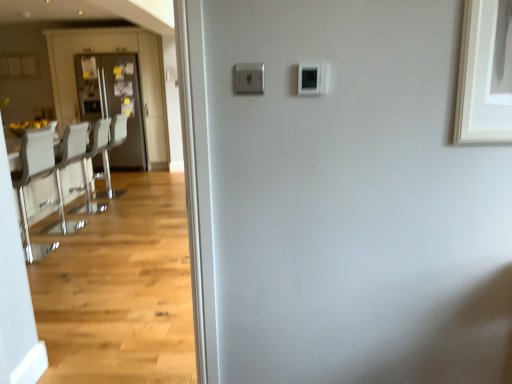
The height and width of the screenshot is (384, 512). Identify the location of matte gray door at left. (114, 102).

The width and height of the screenshot is (512, 384). What do you see at coordinates (112, 52) in the screenshot? I see `matte black refrigerator at left` at bounding box center [112, 52].

What do you see at coordinates (31, 181) in the screenshot?
I see `white glossy chair at left` at bounding box center [31, 181].

In order to face white glossy armchair at left, positioned as the second armchair in back-to-front order, should I rotate leftwards or rightwards?

You should rotate left by 21.530 degrees.

Where is `matte gray door at left`? The width and height of the screenshot is (512, 384). matte gray door at left is located at coordinates (114, 102).

Locate an element on the screen. furniture above the white glossy chair at left (from the image's perspective) is located at coordinates (37, 179).

In the scene shown: Does white glossy chair at left have a greater width compared to white leather chairs at left?

No.

What's the angular difference between white glossy chair at left and white leather chairs at left's facing directions?

There is a 0.000952-degree angle between the facing directions of white glossy chair at left and white leather chairs at left.

Is matte black refrigerator at left bigger than white glossy chair at left?

Correct, matte black refrigerator at left is larger in size than white glossy chair at left.

Which object is closer to the camera, matte black refrigerator at left or white glossy chair at left?

white glossy chair at left.

Is matte black refrigerator at left facing away from white glossy chair at left?

No, matte black refrigerator at left's orientation is not away from white glossy chair at left.

Is matte black refrigerator at left situated inside white glossy chair at left or outside?

matte black refrigerator at left is outside white glossy chair at left.

Between matte black refrigerator at left and white leather chairs at left, which one has larger size?

With larger size is matte black refrigerator at left.

Would you say matte black refrigerator at left contains white leather chairs at left?

Definitely not — white leather chairs at left is not inside matte black refrigerator at left.

Which of these two, matte black refrigerator at left or white leather chairs at left, stands taller?

With more height is matte black refrigerator at left.

Is point (58, 55) behind point (21, 155)?

Yes, it is.

Can you tell me how much white glossy chair at left and matte gray door at left differ in facing direction?

The facing directions of white glossy chair at left and matte gray door at left are 94.1 degrees apart.

From the image's perspective, which is above, white glossy chair at left or matte gray door at left?

matte gray door at left, from the image's perspective.

Considering the positions of points (25, 154) and (83, 100), is point (25, 154) closer to camera compared to point (83, 100)?

Yes, point (25, 154) is closer to viewer.

From a real-world perspective, does white glossy chair at left sit lower than matte gray door at left?

Yes, from a real-world perspective, white glossy chair at left is under matte gray door at left.

Could you tell me if white leather chairs at left is turned towards matte black refrigerator at left?

No, white leather chairs at left is not turned towards matte black refrigerator at left.

Does white leather chairs at left have a greater width compared to matte black refrigerator at left?

Incorrect, the width of white leather chairs at left does not surpass that of matte black refrigerator at left.

Choose the correct answer: Is white leather chairs at left inside matte black refrigerator at left or outside it?

white leather chairs at left cannot be found inside matte black refrigerator at left.

Is point (41, 122) farther from camera compared to point (121, 40)?

No.

Which object is further away from the camera, white leather armchair at left, acting as the first armchair starting from the back, or white glossy chair at left?

white leather armchair at left, acting as the first armchair starting from the back.

Are white leather armchair at left, acting as the first armchair starting from the back, and white glossy chair at left beside each other?

white leather armchair at left, acting as the first armchair starting from the back, and white glossy chair at left are clearly separated.

Considering the sizes of objects white leather armchair at left, acting as the first armchair starting from the back, and white glossy chair at left in the image provided, who is taller, white leather armchair at left, acting as the first armchair starting from the back, or white glossy chair at left?

white leather armchair at left, acting as the first armchair starting from the back.

Looking at this image, is white leather armchair at left, acting as the first armchair starting from the back, bigger than white glossy chair at left?

No.

Is matte gray door at left bigger than white glossy chair at left?

Correct, matte gray door at left is larger in size than white glossy chair at left.

Is matte gray door at left placed right next to white glossy chair at left?

matte gray door at left and white glossy chair at left are not in contact.

Can you tell me how much matte gray door at left and white glossy chair at left differ in facing direction?

matte gray door at left and white glossy chair at left are facing 94.1 degrees away from each other.

From a real-world perspective, is matte gray door at left beneath white glossy chair at left?

No.

Locate an element on the screen. The height and width of the screenshot is (384, 512). chair lying in front of the white leather chairs at left is located at coordinates (31, 181).

The height and width of the screenshot is (384, 512). I want to click on screen door located on the left of white glossy chair at left, so click(x=112, y=52).

From the image, which object appears to be farther from white glossy chair at left, matte black refrigerator at left or matte gray door at left?

matte black refrigerator at left is positioned further to the anchor white glossy chair at left.

Estimate the real-world distances between objects in this image. Which object is further from white leather armchair at left, acting as the first armchair starting from the back, white glossy chair at left or matte gray door at left?

Among the two, white glossy chair at left is located further to white leather armchair at left, acting as the first armchair starting from the back.

Considering their positions, is white glossy chair at left positioned closer to white plastic thermostat at upper center than white glossy armchair at left, positioned as the second armchair in back-to-front order?

white glossy chair at left is closer to white plastic thermostat at upper center.

Which object lies further to the anchor point white glossy armchair at left, placed as the 1th armchair when sorted from front to back, white leather chairs at left or matte black refrigerator at left?

matte black refrigerator at left.

Which object lies further to the anchor point white plastic thermostat at upper center, white leather armchair at left, which appears as the second armchair when viewed from the front, or matte black refrigerator at left?

matte black refrigerator at left is positioned further to the anchor white plastic thermostat at upper center.

Estimate the real-world distances between objects in this image. Which object is further from white leather armchair at left, acting as the first armchair starting from the back, matte gray door at left or white glossy chair at left?

Among the two, white glossy chair at left is located further to white leather armchair at left, acting as the first armchair starting from the back.

Based on their spatial positions, is matte gray door at left or matte black refrigerator at left closer to white glossy chair at left?

The object closer to white glossy chair at left is matte gray door at left.

When comparing their distances from matte black refrigerator at left, does white glossy armchair at left, placed as the 1th armchair when sorted from front to back, or white leather armchair at left, acting as the first armchair starting from the back, seem closer?

white leather armchair at left, acting as the first armchair starting from the back, lies closer to matte black refrigerator at left than the other object.

Identify the location of chair between white plastic thermostat at upper center and white leather chairs at left from front to back. (31, 181).

At what (x,y) coordinates should I click in order to perform the action: click on chair between white plastic thermostat at upper center and white leather armchair at left, acting as the first armchair starting from the back, along the z-axis. Please return your answer as a coordinate pair (x, y). Looking at the image, I should click on (31, 181).

You are a GUI agent. You are given a task and a screenshot of the screen. Output one action in this format:
    pyautogui.click(x=<x>, y=<y>)
    Task: Click on the door located between white plastic thermostat at upper center and matte black refrigerator at left in the depth direction
    This screenshot has width=512, height=384.
    Given the screenshot: What is the action you would take?
    pyautogui.click(x=114, y=102)

Identify the location of armchair positioned between white glossy armchair at left, placed as the 1th armchair when sorted from front to back, and matte gray door at left from near to far. (108, 155).